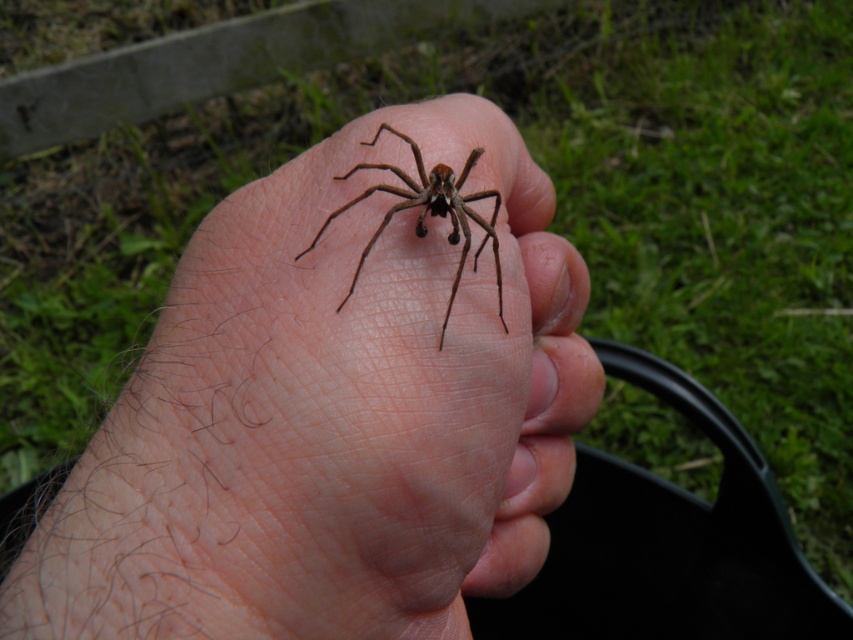
Question: Is brown hairy spider at center below brown fuzzy spider at center?

Choices:
 (A) yes
 (B) no

Answer: (A)

Question: Which object is closer to the camera taking this photo?

Choices:
 (A) brown fuzzy spider at center
 (B) brown hairy spider at center

Answer: (B)

Question: Can you confirm if brown hairy spider at center is wider than brown fuzzy spider at center?

Choices:
 (A) yes
 (B) no

Answer: (A)

Question: Which of the following is the farthest from the observer?

Choices:
 (A) (502, 307)
 (B) (518, 280)

Answer: (B)

Question: Can you confirm if brown hairy spider at center is positioned below brown fuzzy spider at center?

Choices:
 (A) yes
 (B) no

Answer: (A)